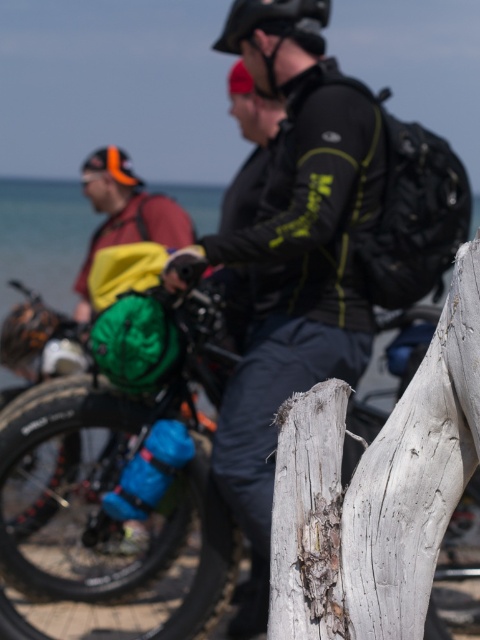
Question: Among these points, which one is nearest to the camera?

Choices:
 (A) (91, 404)
 (B) (180, 252)

Answer: (B)

Question: Can you confirm if matte black bicycle at center is positioned to the left of matte black jacket at center?

Choices:
 (A) no
 (B) yes

Answer: (B)

Question: Does matte black bicycle at center have a smaller size compared to matte black jacket at center?

Choices:
 (A) no
 (B) yes

Answer: (A)

Question: Which point is closer to the camera?

Choices:
 (A) (321, 250)
 (B) (97, 474)

Answer: (A)

Question: Can you confirm if matte black bicycle at center is smaller than matte black jacket at center?

Choices:
 (A) no
 (B) yes

Answer: (A)